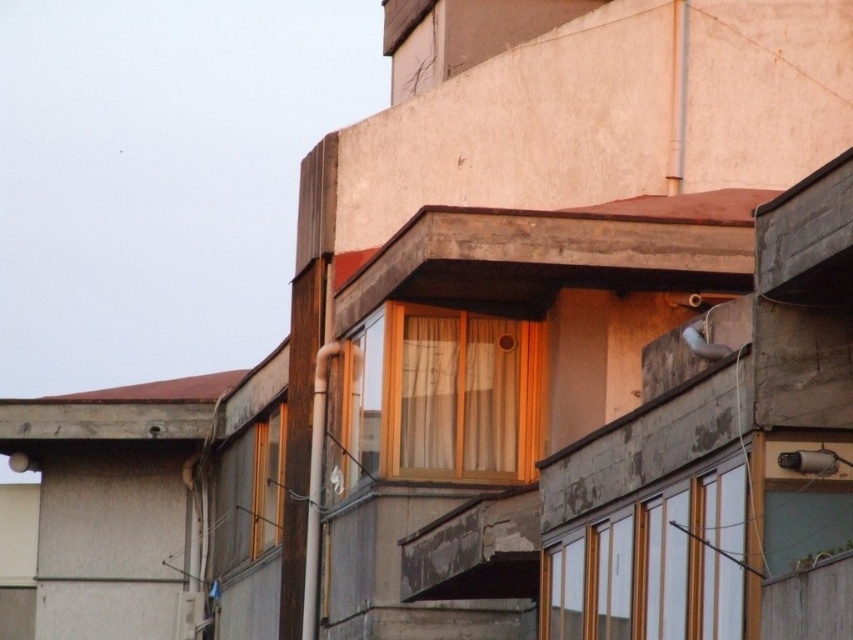
Question: Considering the real-world distances, which object is farthest from the wooden frame window at center?

Choices:
 (A) white matte window at center
 (B) white matte bird at upper right
 (C) translucent beige curtain at center

Answer: (B)

Question: Does white matte window at center appear on the right side of white matte bird at upper right?

Choices:
 (A) yes
 (B) no

Answer: (B)

Question: Is translucent beige curtain at center positioned before white matte bird at upper right?

Choices:
 (A) yes
 (B) no

Answer: (B)

Question: Does white matte window at center appear under wooden frame window at center?

Choices:
 (A) yes
 (B) no

Answer: (B)

Question: Considering the real-world distances, which object is farthest from the translucent beige curtain at center?

Choices:
 (A) white matte window at center
 (B) wooden frame window at center

Answer: (A)

Question: Among these objects, which one is farthest from the camera?

Choices:
 (A) wooden frame window at center
 (B) translucent beige curtain at center

Answer: (A)